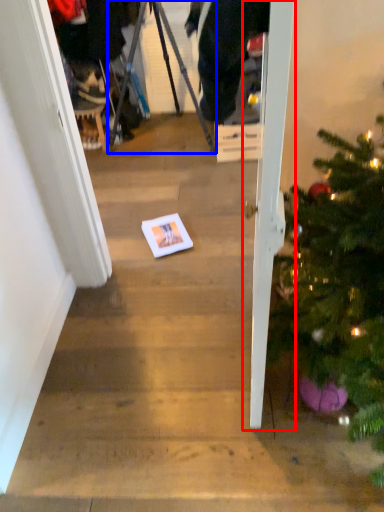
Question: Among these objects, which one is nearest to the camera, door (highlighted by a red box) or tripod (highlighted by a blue box)?

Choices:
 (A) door
 (B) tripod

Answer: (A)